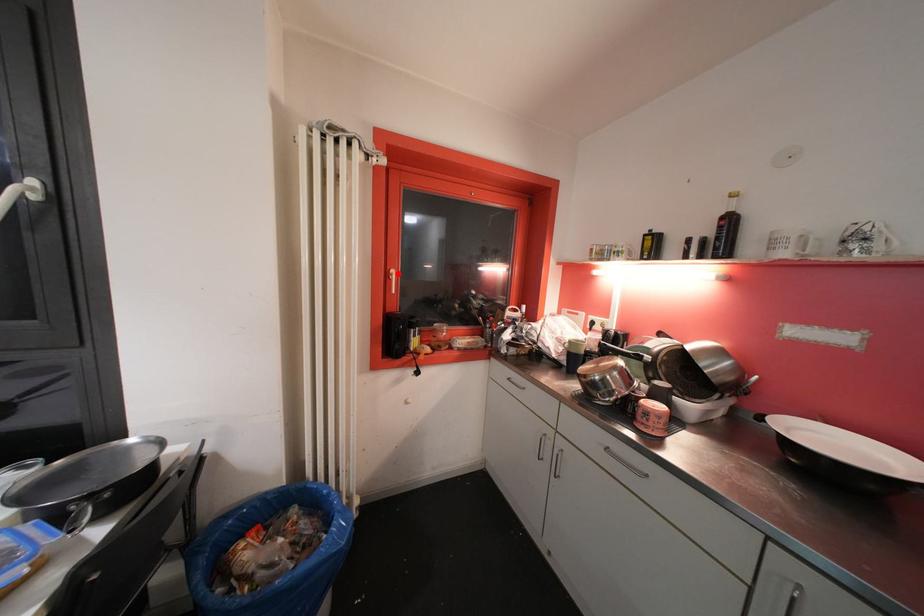
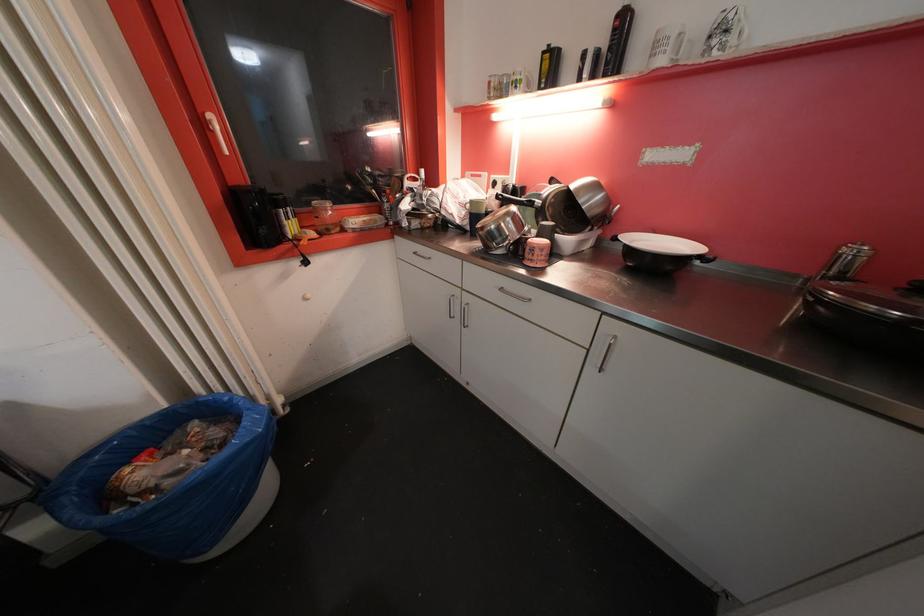
Where in the second image is the point corresponding to the highlighted location from the first image?

(215, 119)